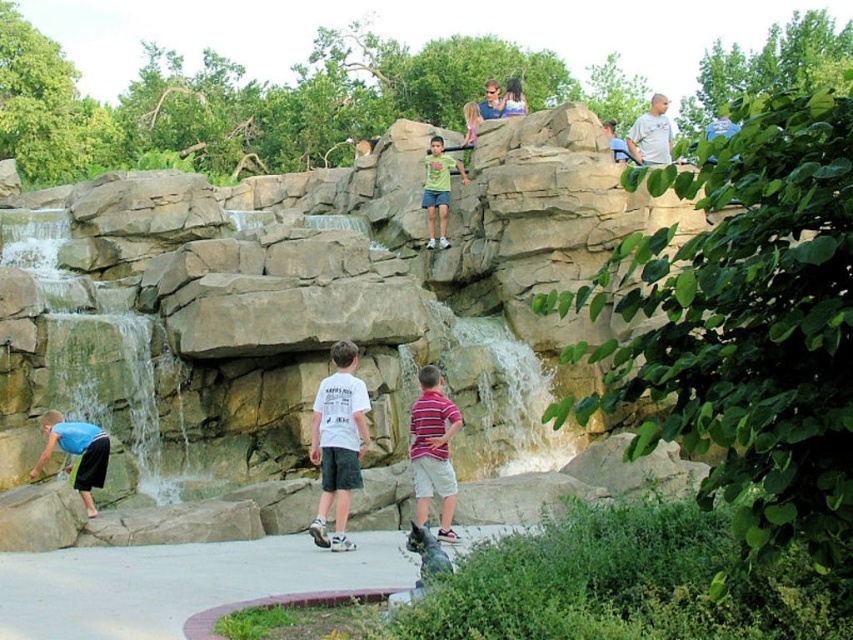
Question: Is natural stone waterfall at upper center closer to camera compared to white cotton shirt at center?

Choices:
 (A) yes
 (B) no

Answer: (A)

Question: Which object appears closest to the camera in this image?

Choices:
 (A) blue matte skateboard at lower left
 (B) white cotton shirt at center
 (C) natural stone waterfall at upper center

Answer: (C)

Question: Which is nearer to the green matte shirt at upper center?

Choices:
 (A) natural stone waterfall at upper center
 (B) white cotton shirt at center

Answer: (A)

Question: Considering the real-world distances, which object is farthest from the white cotton shirt at center?

Choices:
 (A) striped cotton shirt at center
 (B) blue matte skateboard at lower left

Answer: (B)

Question: Is striped cotton shirt at center above green matte shirt at upper center?

Choices:
 (A) yes
 (B) no

Answer: (B)

Question: Can you confirm if natural stone waterfall at upper center is positioned below striped cotton shirt at center?

Choices:
 (A) no
 (B) yes

Answer: (A)